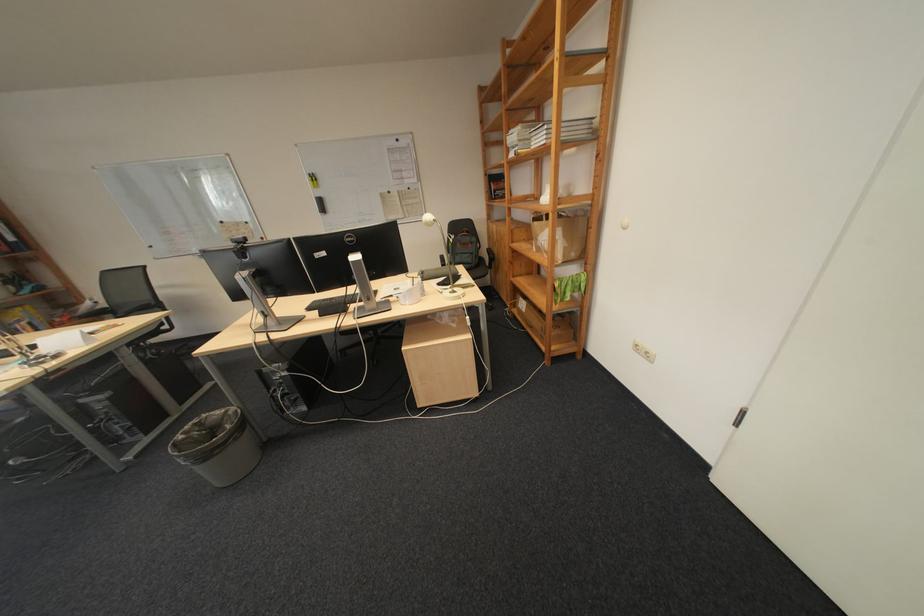
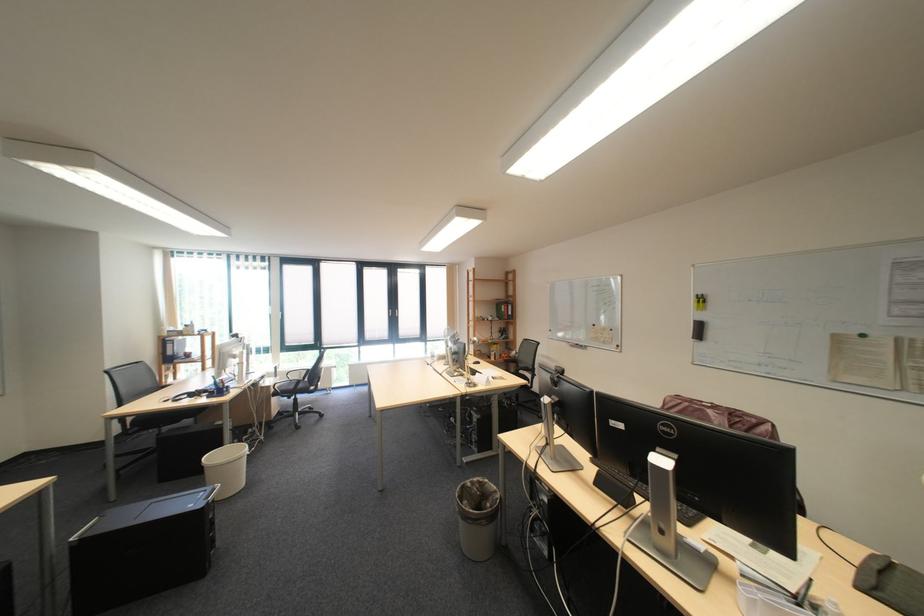
Question: The camera is either moving clockwise (left) or counter-clockwise (right) around the object. The first image is from the beginning of the video and the second image is from the end. Is the camera moving left or right when shooting the video?

Choices:
 (A) Left
 (B) Right

Answer: (B)